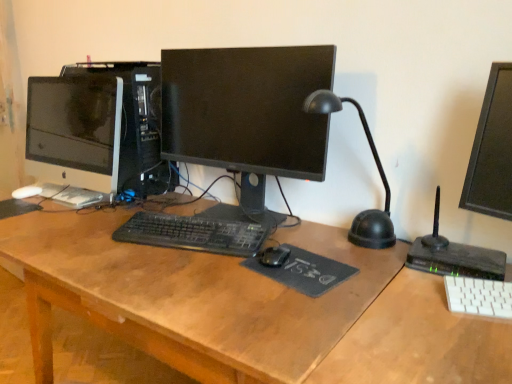
Find the location of `vacant space that's between black matte keyboard at center, the 1th computer keyboard when ordered from top to bottom, and black fabric mousepad at center, marked as the 2th mousepad in a top-to-bottom arrangement`. vacant space that's between black matte keyboard at center, the 1th computer keyboard when ordered from top to bottom, and black fabric mousepad at center, marked as the 2th mousepad in a top-to-bottom arrangement is located at coordinates (206, 258).